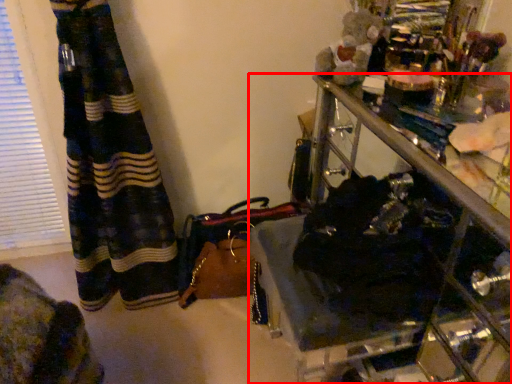
Question: From the image's perspective, what is the correct spatial positioning of furniture (annotated by the red box) in reference to handbag?

Choices:
 (A) above
 (B) below

Answer: (A)